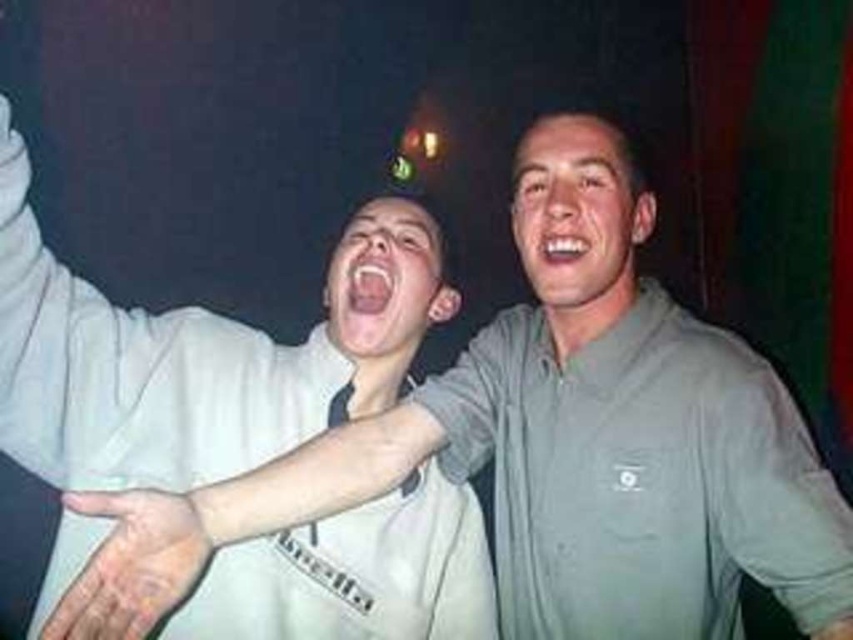
You are a photographer at a party. You notice two white objects in the center of your frame. One is a white fabric arm at center, and the other is white glossy teeth at center. Which object is positioned lower in the image?

The white fabric arm at center is located below the white glossy teeth at center, so it is positioned lower in the image.